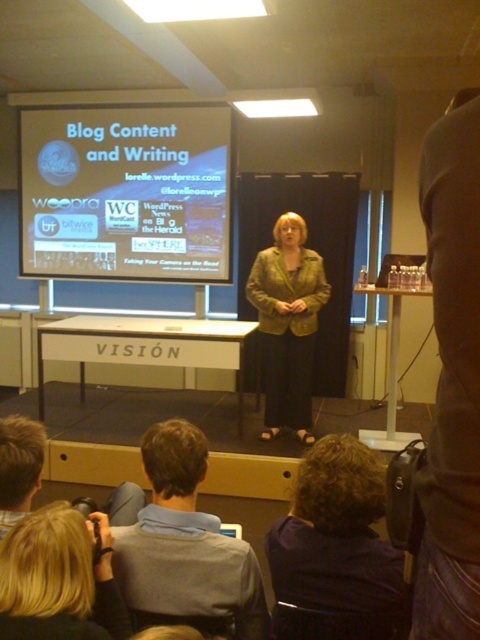
Is the position of dark blue fabric at lower center less distant than that of blonde hair at lower left?

No, it is not.

Who is more forward, (344,554) or (36,602)?

Point (36,602) is in front.

Who is more distant from viewer, [324,484] or [71,621]?

The point [324,484] is behind.

The width and height of the screenshot is (480, 640). Identify the location of dark blue fabric at lower center. (336, 548).

Is white matte projection screen at upper center wider than gray fabric shirt at center?

Correct, the width of white matte projection screen at upper center exceeds that of gray fabric shirt at center.

Does white matte projection screen at upper center have a larger size compared to gray fabric shirt at center?

Yes, white matte projection screen at upper center is bigger than gray fabric shirt at center.

Who is more distant from viewer, (81, 214) or (203, 516)?

The point (81, 214) is behind.

Where is `white matte projection screen at upper center`? The width and height of the screenshot is (480, 640). white matte projection screen at upper center is located at coordinates (126, 193).

Between point (249, 586) and point (36, 637), which one is positioned behind?

The point (249, 586) is behind.

Does point (149, 602) come in front of point (48, 506)?

No, it is behind (48, 506).

Identify the location of gray fabric shirt at center. The image size is (480, 640). (186, 541).